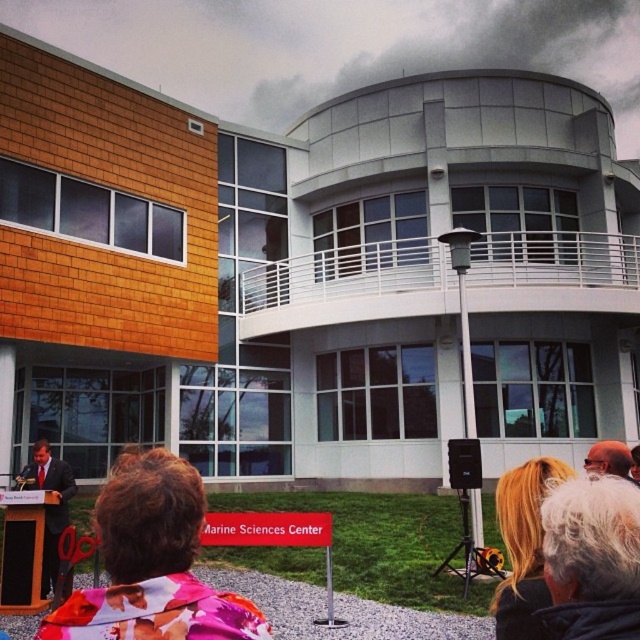
Question: Which of the following is the farthest from the observer?

Choices:
 (A) (536, 636)
 (B) (108, 518)

Answer: (A)

Question: Does floral fabric jacket at lower center come behind blonde hair at upper right?

Choices:
 (A) yes
 (B) no

Answer: (B)

Question: Can you confirm if floral fabric jacket at lower center is smaller than blonde hair at upper right?

Choices:
 (A) no
 (B) yes

Answer: (A)

Question: Which point is closer to the camera?

Choices:
 (A) floral fabric jacket at lower center
 (B) blonde hair at upper right

Answer: (A)

Question: Can you confirm if floral fabric jacket at lower center is wider than blonde hair at upper right?

Choices:
 (A) yes
 (B) no

Answer: (B)